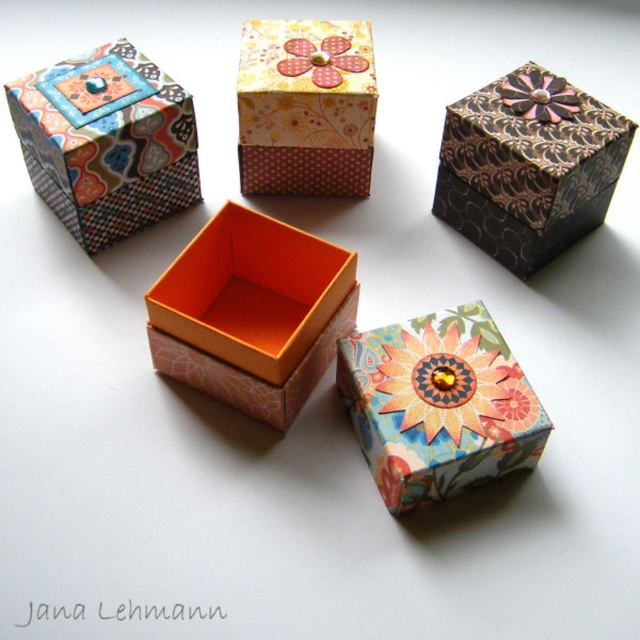
Is the position of orange matte box at center less distant than that of metallic gold flower at upper right?

Yes, orange matte box at center is closer to the viewer.

Can you confirm if orange matte box at center is thinner than metallic gold flower at upper right?

No.

The image size is (640, 640). Find the location of `orange matte box at center`. orange matte box at center is located at coordinates (252, 312).

I want to click on orange matte box at center, so click(x=252, y=312).

Can you confirm if orange matte box at center is taller than matte paper gift box at upper left?

In fact, orange matte box at center may be shorter than matte paper gift box at upper left.

Between orange matte box at center and matte paper gift box at upper left, which one is positioned lower?

orange matte box at center is below.

This screenshot has height=640, width=640. Identify the location of orange matte box at center. (252, 312).

Locate an element on the screen. orange matte box at center is located at coordinates (252, 312).

From the picture: Can you confirm if orange matte box at center is positioned to the left of pink fabric flower at upper center?

Correct, you'll find orange matte box at center to the left of pink fabric flower at upper center.

Can you confirm if orange matte box at center is positioned above pink fabric flower at upper center?

No, orange matte box at center is not above pink fabric flower at upper center.

This screenshot has height=640, width=640. What are the coordinates of `orange matte box at center` in the screenshot? It's located at (252, 312).